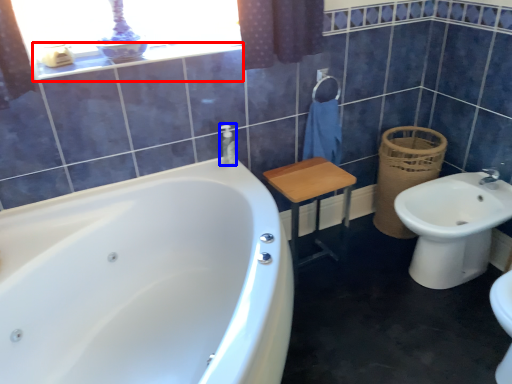
Question: Which object is further to the camera taking this photo, balustrade (highlighted by a red box) or toiletry (highlighted by a blue box)?

Choices:
 (A) balustrade
 (B) toiletry

Answer: (B)